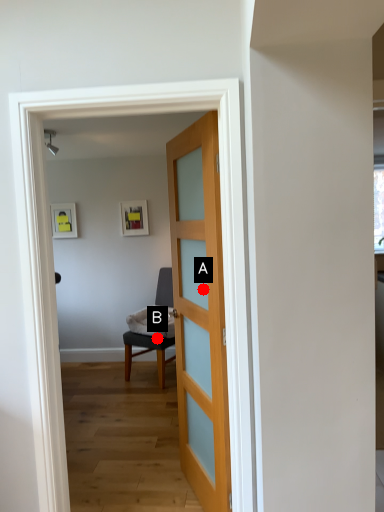
Question: Two points are circled on the image, labeled by A and B beside each circle. Which of the following is the closest to the observer?

Choices:
 (A) A is closer
 (B) B is closer

Answer: (A)